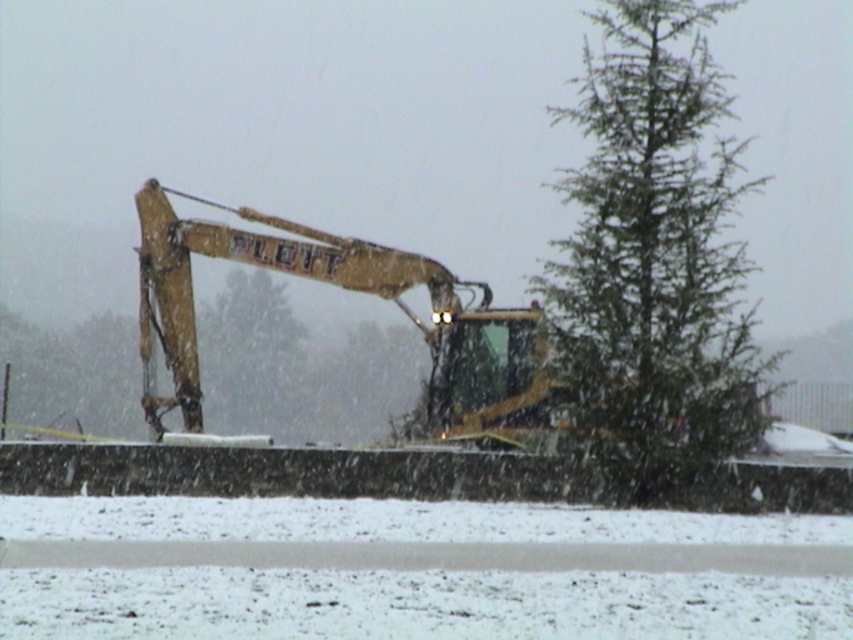
You are standing at the point marked as point [654,259] in the image. Looking around, you see a green needle like tree at right. Which direction should you face to see the green needle like tree at right?

The green needle like tree at right is located at point [654,259], so you are already facing it.